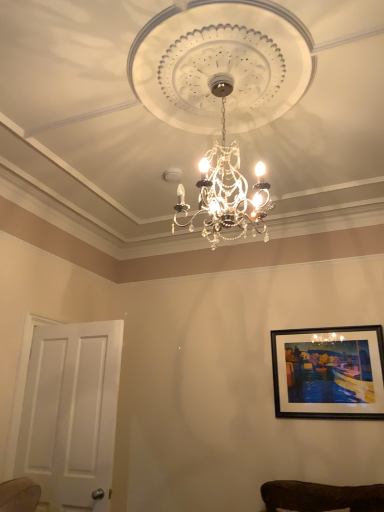
Question: From the image's perspective, is white matte door at left on top of black matte picture frame at upper right?

Choices:
 (A) yes
 (B) no

Answer: (B)

Question: Is white matte door at left directly adjacent to black matte picture frame at upper right?

Choices:
 (A) yes
 (B) no

Answer: (B)

Question: Is white matte door at left behind black matte picture frame at upper right?

Choices:
 (A) yes
 (B) no

Answer: (B)

Question: Is white matte door at left bigger than black matte picture frame at upper right?

Choices:
 (A) no
 (B) yes

Answer: (B)

Question: From a real-world perspective, does white matte door at left stand above black matte picture frame at upper right?

Choices:
 (A) yes
 (B) no

Answer: (B)

Question: Is white matte door at left wider or thinner than black matte picture frame at upper right?

Choices:
 (A) thin
 (B) wide

Answer: (B)

Question: Considering the relative positions of white matte door at left and black matte picture frame at upper right in the image provided, is white matte door at left to the left or to the right of black matte picture frame at upper right?

Choices:
 (A) right
 (B) left

Answer: (B)

Question: In terms of height, does white matte door at left look taller or shorter compared to black matte picture frame at upper right?

Choices:
 (A) tall
 (B) short

Answer: (A)

Question: From the image's perspective, is white matte door at left above or below black matte picture frame at upper right?

Choices:
 (A) below
 (B) above

Answer: (A)

Question: Is crystal glass chandelier at center bigger or smaller than white matte door at left?

Choices:
 (A) big
 (B) small

Answer: (A)

Question: Does point (230, 164) appear closer or farther from the camera than point (74, 367)?

Choices:
 (A) farther
 (B) closer

Answer: (B)

Question: From a real-world perspective, relative to white matte door at left, is crystal glass chandelier at center vertically above or below?

Choices:
 (A) above
 (B) below

Answer: (A)

Question: From the image's perspective, is crystal glass chandelier at center located above or below white matte door at left?

Choices:
 (A) below
 (B) above

Answer: (B)

Question: Considering the positions of point (377, 327) and point (198, 205), is point (377, 327) closer or farther from the camera than point (198, 205)?

Choices:
 (A) closer
 (B) farther

Answer: (B)

Question: Is black matte picture frame at upper right to the left or to the right of crystal glass chandelier at center in the image?

Choices:
 (A) right
 (B) left

Answer: (A)